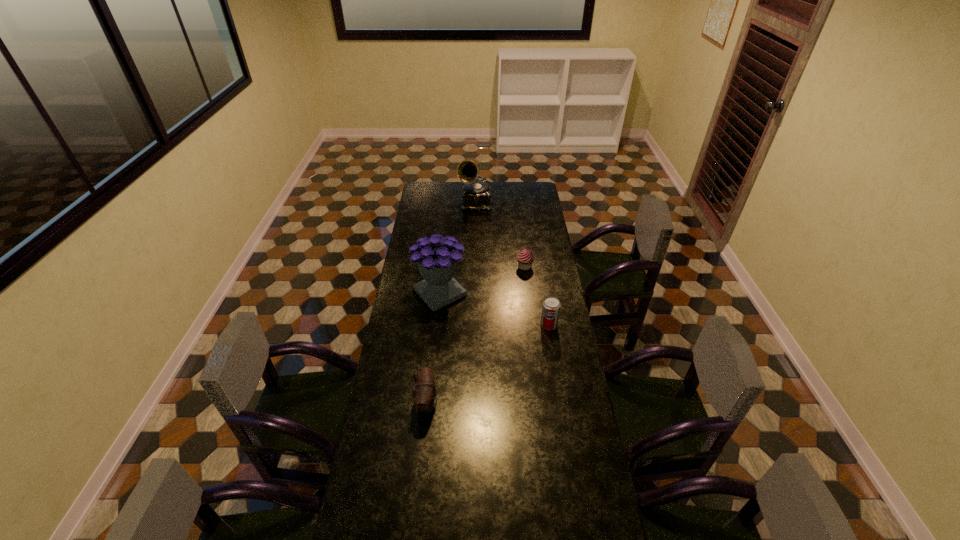
Where is `the farthest object`? Image resolution: width=960 pixels, height=540 pixels. the farthest object is located at coordinates (476, 195).

Locate an element on the screen. bouquet is located at coordinates (437, 259).

Locate an element on the screen. the second nearest object is located at coordinates (551, 306).

Where is `the nearest object`? This screenshot has height=540, width=960. the nearest object is located at coordinates (424, 395).

Find the location of `the shortest object`. the shortest object is located at coordinates (525, 258).

This screenshot has height=540, width=960. Identify the location of the fourth nearest object. (525, 258).

Identify the location of vacant space located on the horn of the farthest object. The image size is (960, 540). (475, 247).

Identify the location of vacant space located 0.150m on the back of the third farthest object. This screenshot has width=960, height=540. (444, 256).

Where is `vacant space positioned 0.050m on the left of the second nearest object`? vacant space positioned 0.050m on the left of the second nearest object is located at coordinates (529, 325).

The height and width of the screenshot is (540, 960). I want to click on free space located 0.330m with the flap open on the pouch, so click(527, 403).